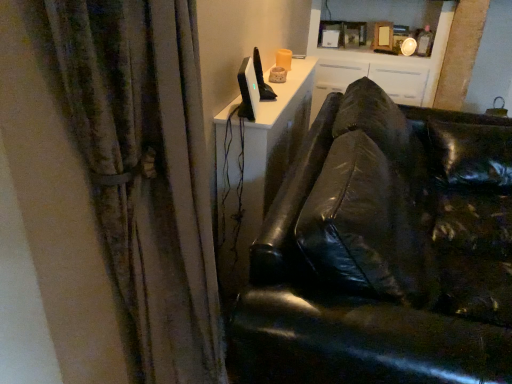
Question: Can you confirm if white glossy cabinet at upper center is positioned to the right of textured fabric curtain at left?

Choices:
 (A) no
 (B) yes

Answer: (B)

Question: From the image's perspective, does white glossy cabinet at upper center appear higher than textured fabric curtain at left?

Choices:
 (A) yes
 (B) no

Answer: (A)

Question: Is white glossy cabinet at upper center outside of textured fabric curtain at left?

Choices:
 (A) no
 (B) yes

Answer: (B)

Question: Considering the relative sizes of white glossy cabinet at upper center and textured fabric curtain at left in the image provided, is white glossy cabinet at upper center wider than textured fabric curtain at left?

Choices:
 (A) no
 (B) yes

Answer: (B)

Question: Considering the relative positions of white glossy cabinet at upper center and textured fabric curtain at left in the image provided, is white glossy cabinet at upper center to the left of textured fabric curtain at left from the viewer's perspective?

Choices:
 (A) yes
 (B) no

Answer: (B)

Question: Considering the positions of textured fabric curtain at left and satin black monitor at upper center in the image, is textured fabric curtain at left bigger or smaller than satin black monitor at upper center?

Choices:
 (A) big
 (B) small

Answer: (A)

Question: From the image's perspective, is textured fabric curtain at left located above or below satin black monitor at upper center?

Choices:
 (A) below
 (B) above

Answer: (A)

Question: From a real-world perspective, is textured fabric curtain at left physically located above or below satin black monitor at upper center?

Choices:
 (A) below
 (B) above

Answer: (A)

Question: Would you say textured fabric curtain at left is inside or outside satin black monitor at upper center?

Choices:
 (A) inside
 (B) outside

Answer: (B)

Question: Is white glossy cabinet at upper center in front of or behind satin black monitor at upper center in the image?

Choices:
 (A) front
 (B) behind

Answer: (B)

Question: From a real-world perspective, is white glossy cabinet at upper center physically located above or below satin black monitor at upper center?

Choices:
 (A) below
 (B) above

Answer: (A)

Question: From the image's perspective, is white glossy cabinet at upper center located above or below satin black monitor at upper center?

Choices:
 (A) above
 (B) below

Answer: (A)

Question: In terms of height, does white glossy cabinet at upper center look taller or shorter compared to satin black monitor at upper center?

Choices:
 (A) short
 (B) tall

Answer: (B)

Question: Is satin black monitor at upper center in front of or behind textured fabric curtain at left in the image?

Choices:
 (A) front
 (B) behind

Answer: (B)

Question: Considering the positions of point (251, 74) and point (53, 49), is point (251, 74) closer or farther from the camera than point (53, 49)?

Choices:
 (A) farther
 (B) closer

Answer: (A)